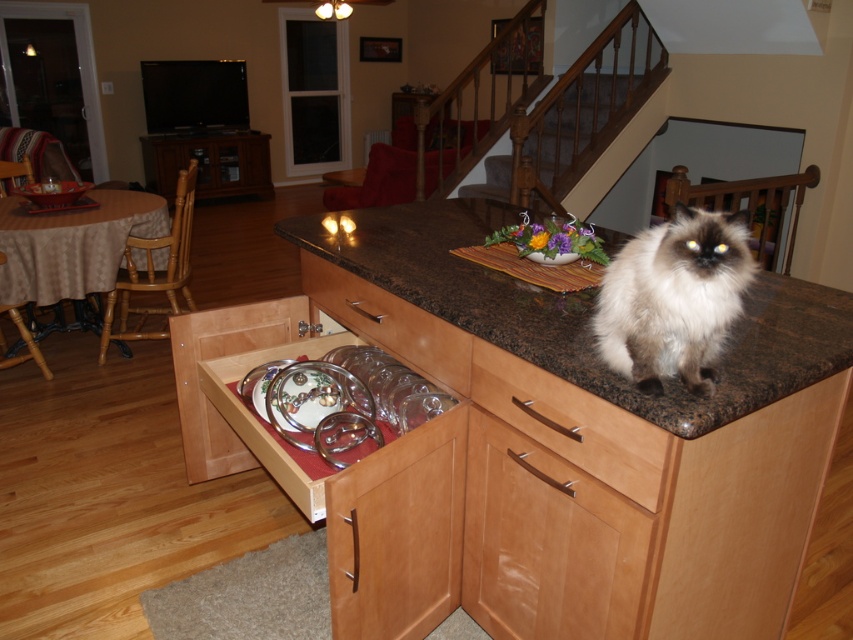
You are a chef preparing to place a 10 inch plate on the granite countertop at center. There is a wooden drawer at center nearby. Can the plate fit between them without touching either?

The granite countertop at center and wooden drawer at center are 11.12 inches apart, so a 10 inch plate can fit between them without touching either.

You are a chef preparing a meal and need to place a 10 inch diameter plate on the granite countertop at center. Can you fit the plate on the countertop without overlapping the clear glass plates at center?

The distance between the granite countertop at center and the clear glass plates at center is 9.25 inches. Since the plate is 10 inches in diameter, it would require at least 5 inches of space to center it without overlapping. Therefore, the plate cannot be placed without overlapping the clear glass plates at center.

You are a visitor in the house and want to know if the white fluffy cat at center is bigger than the wooden drawer at center. Can you tell me?

The white fluffy cat at center is larger in size than wooden drawer at center.